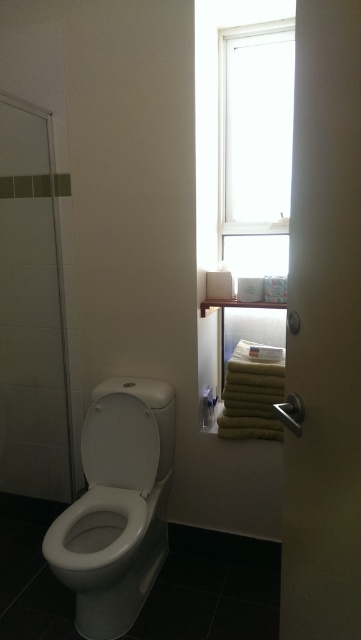
You are standing in the bathroom and need to reach the window with the white frame. Which object, the white glossy toilet at lower left, is closer to the window?

The white glossy toilet at lower left is located at point (116, 506), so it is closer to the window than the other objects mentioned.

You are a cleaning robot with a height of 30 inches. You need to clean the transparent glass window at upper center but must avoid touching the white glossy toilet lid at center. Can you reach the window without hitting the toilet lid?

The distance between the transparent glass window at upper center and the white glossy toilet lid at center is 32.48 inches. Since the robot is only 30 inches tall, it can safely reach the window without touching the toilet lid as there is enough clearance between them.

In the scene shown: You are standing in the bathroom and want to check if you can reach the transparent glass window at upper center to clean it. Your height is 1.6 meters and you can reach up to 0.5 meters above your head. Can you reach the window?

The distance between you and the transparent glass window at upper center is 2.09 meters. Since your maximum reach is 1.6 meters plus 0.5 meters equals 2.1 meters, you can barely reach the window.